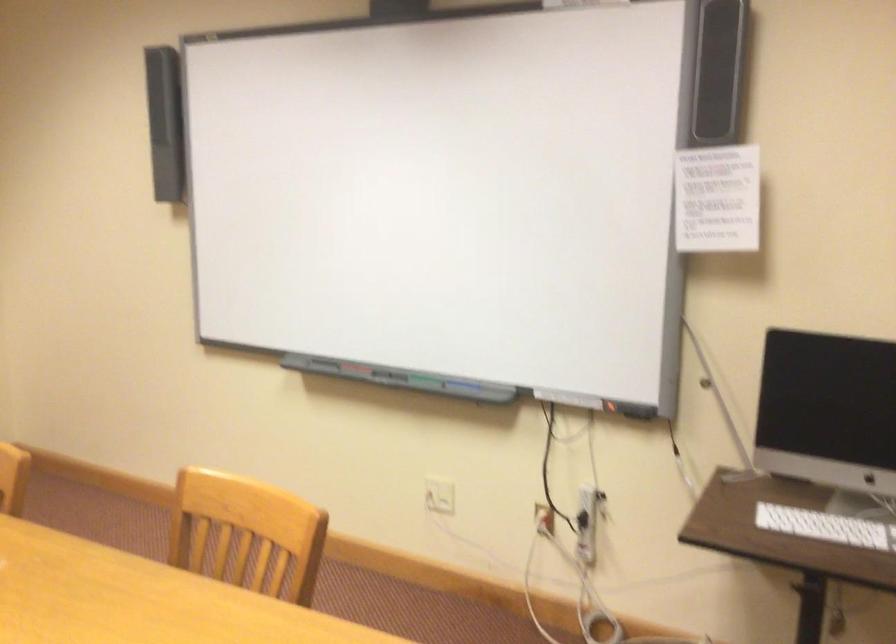
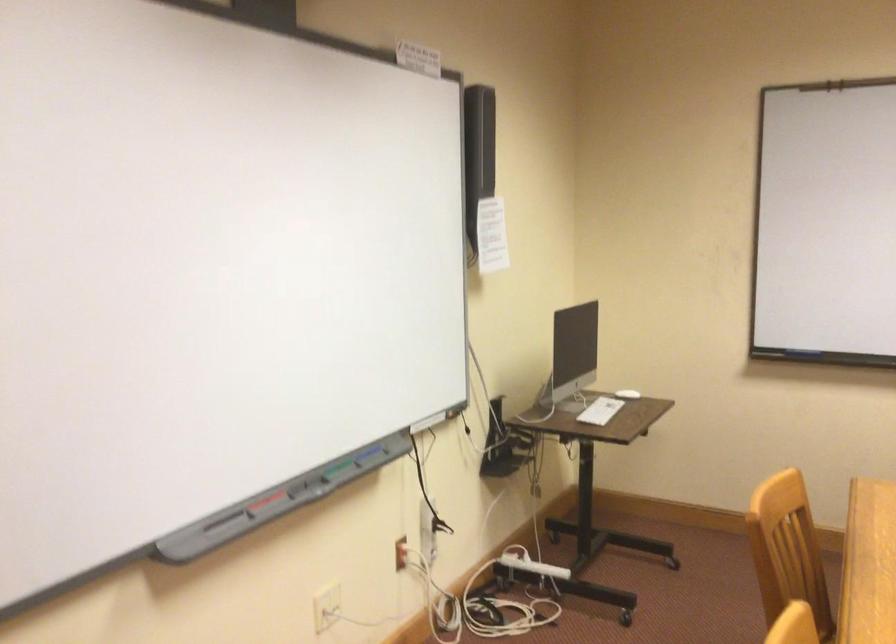
Where in the second image is the point corresponding to point 817,525 from the first image?

(600, 410)